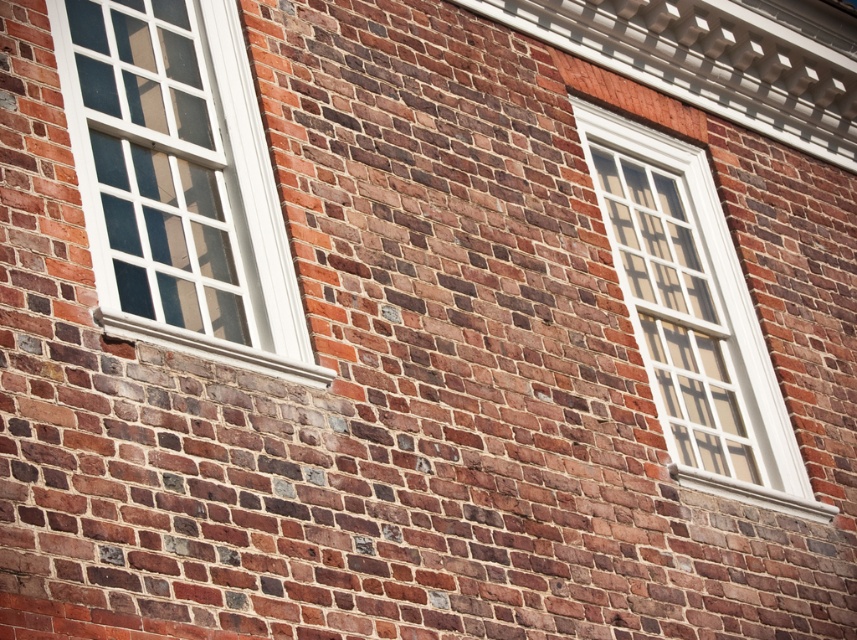
Is white wood window at left smaller than white glass window at upper right?

Indeed, white wood window at left has a smaller size compared to white glass window at upper right.

Between white wood window at left and white glass window at upper right, which one appears on the right side from the viewer's perspective?

white glass window at upper right

Is point (93, 145) less distant than point (758, 424)?

Yes, point (93, 145) is in front of point (758, 424).

Find the location of a particular element. white wood window at left is located at coordinates (178, 182).